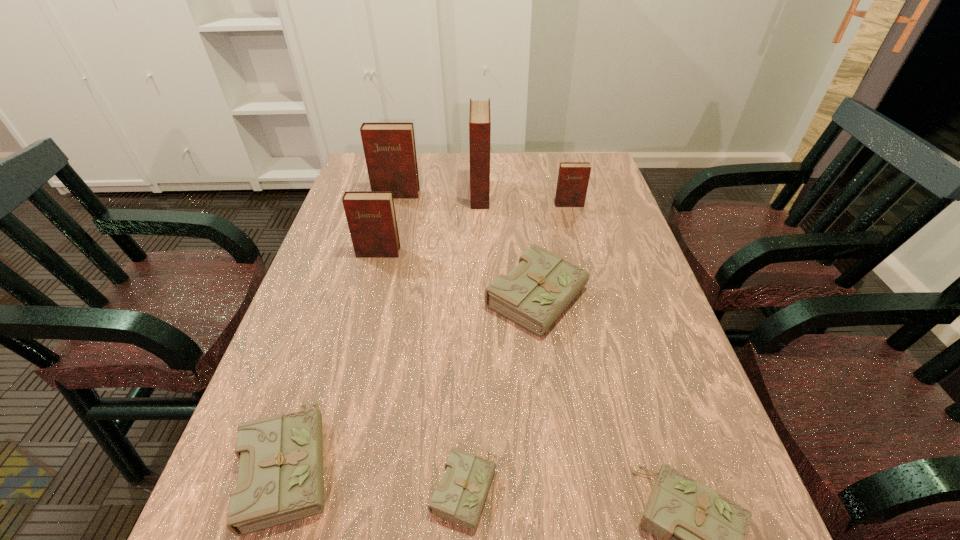
The image size is (960, 540). I want to click on free location located 0.270m on the right of the shortest diary, so click(x=659, y=488).

You are a GUI agent. You are given a task and a screenshot of the screen. Output one action in this format:
    pyautogui.click(x=<x>, y=<y>)
    Task: Click on the object positioned at the far edge
    
    Given the screenshot: What is the action you would take?
    [x=479, y=115]

This screenshot has width=960, height=540. I want to click on object positioned at the near left corner, so click(x=280, y=479).

In the image, there is a desktop. At what (x,y) coordinates should I click in order to perform the action: click on vacant space at the far edge. Please return your answer as a coordinate pair (x, y). The width and height of the screenshot is (960, 540). Looking at the image, I should click on (540, 188).

Find the location of a particular element. vacant area at the near edge is located at coordinates click(453, 536).

Find the location of a particular element. vacant space at the left edge of the desktop is located at coordinates (344, 392).

You are a GUI agent. You are given a task and a screenshot of the screen. Output one action in this format:
    pyautogui.click(x=<x>, y=<y>)
    Task: Click on the vacant region between the leftmost green diary and the smallest green diary
    The height and width of the screenshot is (540, 960).
    Given the screenshot: What is the action you would take?
    pyautogui.click(x=376, y=475)

Locate an element on the screen. The image size is (960, 540). free space between the smallest green diary and the third smallest reddish-brown diary is located at coordinates (430, 341).

Locate an element on the screen. Image resolution: width=960 pixels, height=540 pixels. free area in between the fifth farthest object and the third biggest reddish-brown diary is located at coordinates (459, 275).

I want to click on vacant space that is in between the third shortest diary and the rightmost reddish-brown diary, so click(429, 333).